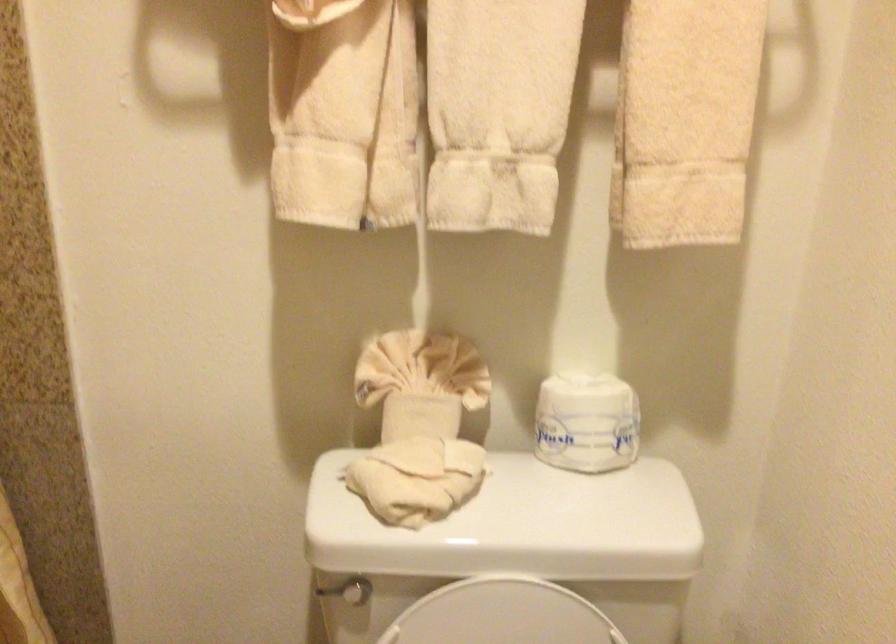
Where is `toilet flush handle`? toilet flush handle is located at coordinates (326, 590).